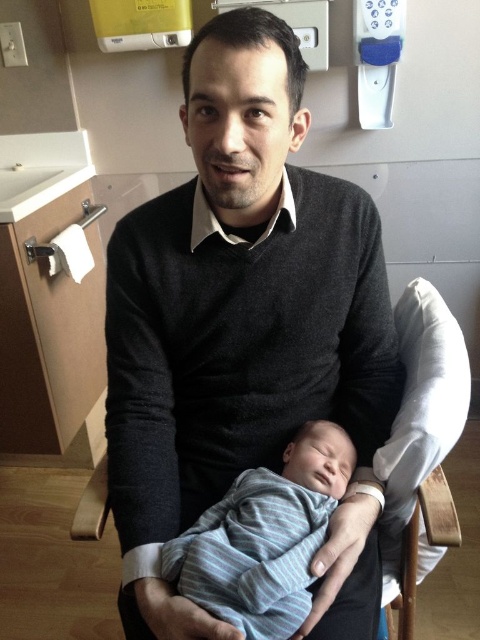
Between point (238, 512) and point (457, 410), which one is positioned in front?

Point (238, 512)

Can you confirm if striped knit onesie at center is smaller than wooden rocking chair at center?

Correct, striped knit onesie at center occupies less space than wooden rocking chair at center.

This screenshot has height=640, width=480. Describe the element at coordinates (264, 538) in the screenshot. I see `striped knit onesie at center` at that location.

Locate an element on the screen. The image size is (480, 640). striped knit onesie at center is located at coordinates (264, 538).

Is dark gray sweater at center to the left of striped knit onesie at center from the viewer's perspective?

Answer: Correct, you'll find dark gray sweater at center to the left of striped knit onesie at center.

Is point (205, 81) farther from camera compared to point (199, 580)?

No, (205, 81) is in front of (199, 580).

Where is `dark gray sweater at center`? dark gray sweater at center is located at coordinates (244, 332).

Who is shorter, dark gray sweater at center or wooden rocking chair at center?

With less height is wooden rocking chair at center.

Who is taller, dark gray sweater at center or wooden rocking chair at center?

Standing taller between the two is dark gray sweater at center.

The height and width of the screenshot is (640, 480). What do you see at coordinates (244, 332) in the screenshot?
I see `dark gray sweater at center` at bounding box center [244, 332].

Identify the location of dark gray sweater at center. This screenshot has height=640, width=480. (244, 332).